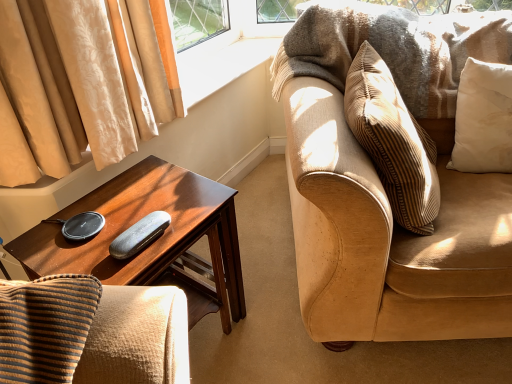
Question: Considering the positions of point (210, 302) and point (116, 249), is point (210, 302) closer or farther from the camera than point (116, 249)?

Choices:
 (A) farther
 (B) closer

Answer: (A)

Question: From the image's perspective, is shiny brown wood desk at left located above or below black textured case at center?

Choices:
 (A) below
 (B) above

Answer: (A)

Question: Estimate the real-world distances between objects in this image. Which object is closer to the white cotton pillow at upper right?

Choices:
 (A) suede couch at right
 (B) shiny brown wood desk at left
 (C) black textured case at center

Answer: (A)

Question: Which is farther from the white cotton pillow at upper right?

Choices:
 (A) suede couch at right
 (B) black textured case at center
 (C) shiny brown wood desk at left

Answer: (B)